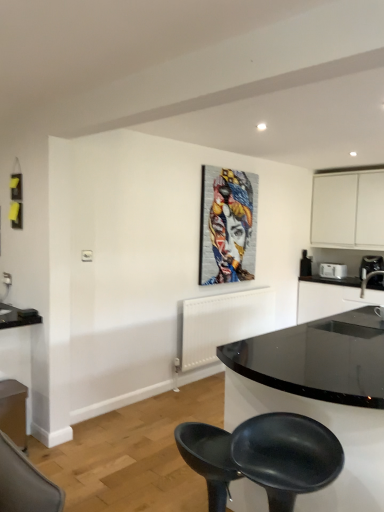
Question: Considering the positions of point (16, 436) and point (347, 289), is point (16, 436) closer or farther from the camera than point (347, 289)?

Choices:
 (A) closer
 (B) farther

Answer: (A)

Question: In terms of height, does matte white cabinet at lower left, the first cabinetry positioned from the left, look taller or shorter compared to black glossy countertop at right?

Choices:
 (A) short
 (B) tall

Answer: (A)

Question: Which of these objects is positioned farthest from the black matte stool at lower center, which is the second chair from back to front?

Choices:
 (A) metallic textured painting at center
 (B) black glossy countertop at right
 (C) matte white cabinet at lower left, the first cabinetry positioned from the left
 (D) black glossy sink at right
 (E) white plastic toaster at right, arranged as the 2th appliance when viewed from the left

Answer: (E)

Question: Which is farther from the white plastic toaster at right, marked as the 1th appliance in a right-to-left arrangement?

Choices:
 (A) black matte stool at lower center, positioned as the 2th chair in front-to-back order
 (B) matte white cabinet at lower left, which is the first cabinetry from bottom to top
 (C) black plastic toaster at upper right, the first appliance viewed from the left
 (D) black matte stool at lower center, which is the first chair from front to back
 (E) black glossy sink at right

Answer: (D)